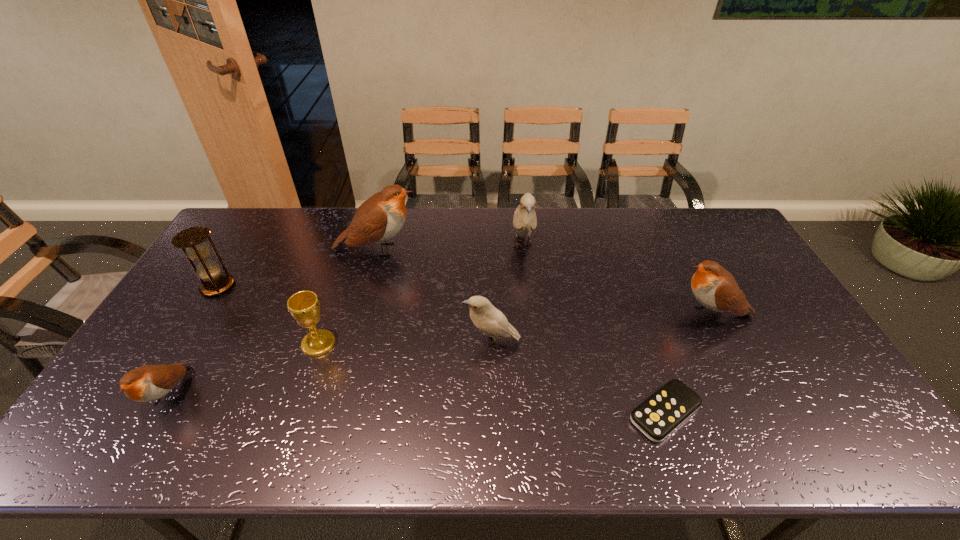
Find the location of a particular element. The height and width of the screenshot is (540, 960). vacant point located between the gold chalice and the smaller white bird is located at coordinates (405, 343).

The height and width of the screenshot is (540, 960). What are the coordinates of `free spot between the nearer white bird and the leftmost bird` in the screenshot? It's located at 330,368.

Image resolution: width=960 pixels, height=540 pixels. I want to click on free spot between the hourglass and the farther white bird, so click(371, 266).

Identify the location of free spot between the brown hourglass and the rightmost object. Image resolution: width=960 pixels, height=540 pixels. (465, 300).

At what (x,y) coordinates should I click in order to perform the action: click on object that can be found as the fifth closest to the smallest brown bird. Please return your answer as a coordinate pair (x, y). Image resolution: width=960 pixels, height=540 pixels. Looking at the image, I should click on (524, 220).

Locate which object is the second closest to the fourth farthest bird. Please provide its 2D coordinates. Your answer should be formatted as a tuple, i.e. [(x, y)], where the tuple contains the x and y coordinates of a point satisfying the conditions above.

[(524, 220)]

Identify which bird is located as the fourth nearest to the fourth bird from right to left. Please provide its 2D coordinates. Your answer should be formatted as a tuple, i.e. [(x, y)], where the tuple contains the x and y coordinates of a point satisfying the conditions above.

[(715, 288)]

Locate an element on the screen. Image resolution: width=960 pixels, height=540 pixels. bird that can be found as the fifth closest to the hourglass is located at coordinates (715, 288).

Locate an element on the screen. This screenshot has height=540, width=960. the closest brown bird to the chalice is located at coordinates (147, 383).

At what (x,y) coordinates should I click in order to perform the action: click on brown bird identified as the closest to the nearest bird. Please return your answer as a coordinate pair (x, y). Looking at the image, I should click on (378, 219).